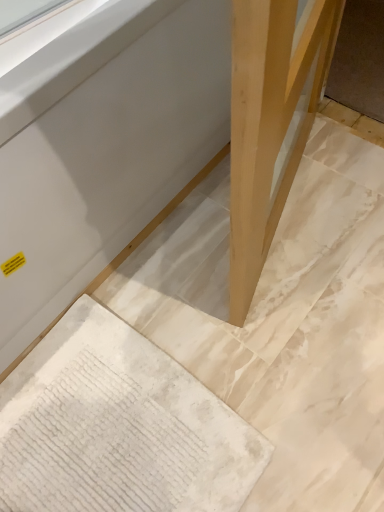
You are a GUI agent. You are given a task and a screenshot of the screen. Output one action in this format:
    pyautogui.click(x=<x>, y=<y>)
    Task: Click on the vacant space that is to the left of natural wood leg at center
    The height and width of the screenshot is (512, 384).
    Given the screenshot: What is the action you would take?
    pyautogui.click(x=182, y=247)